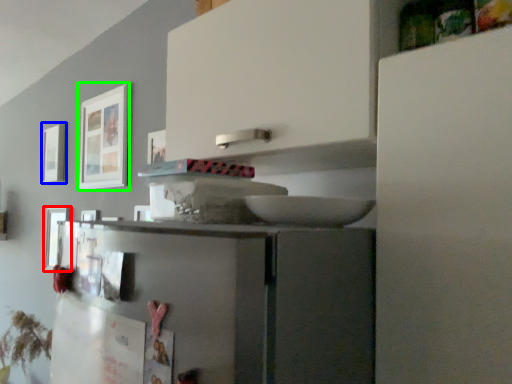
Question: Based on their relative distances, which object is nearer to picture frame (highlighted by a red box)? Choose from picture frame (highlighted by a blue box) and picture frame (highlighted by a green box).

Choices:
 (A) picture frame
 (B) picture frame

Answer: (A)